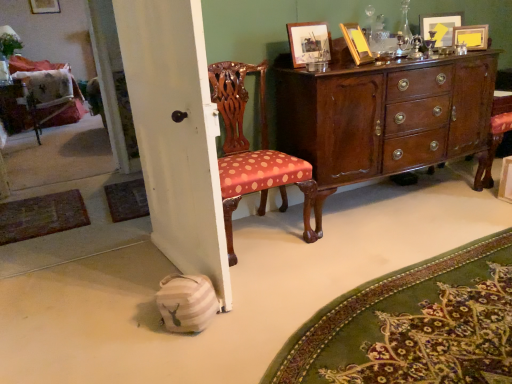
Find the location of a particular element. free location in front of polished wood chair at center is located at coordinates (273, 276).